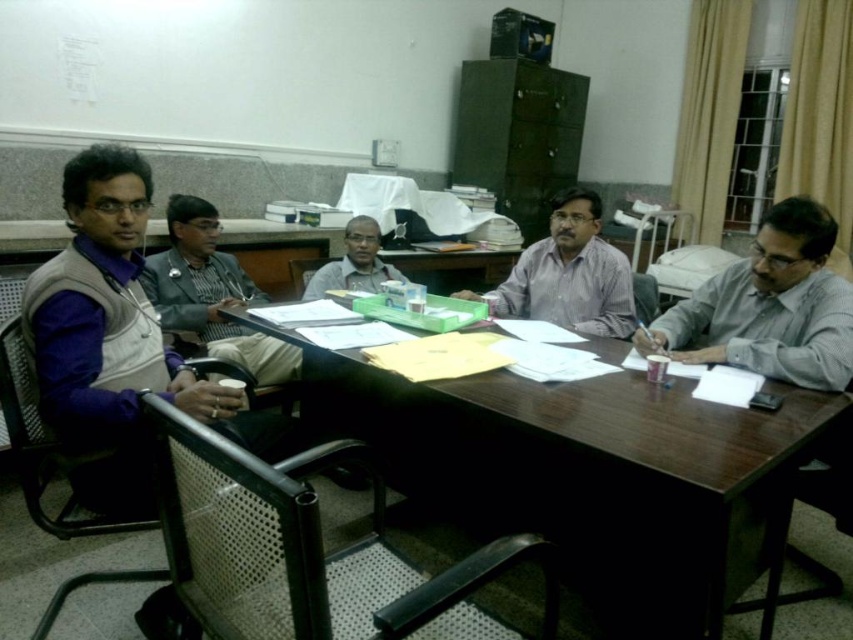
You are a photographer trying to capture a candid shot of the gray matte shirt at right and the matte gray sweater at center. Since the lighting is dim, you want to ensure both subjects are in focus. Given their positions relative to each other, which one should you focus on first to maximize the chances of both being sharp?

The gray matte shirt at right is below the matte gray sweater at center, so focusing on the matte gray sweater at center first would place it closer to the optimal focal plane, increasing the likelihood that both subjects remain in focus.